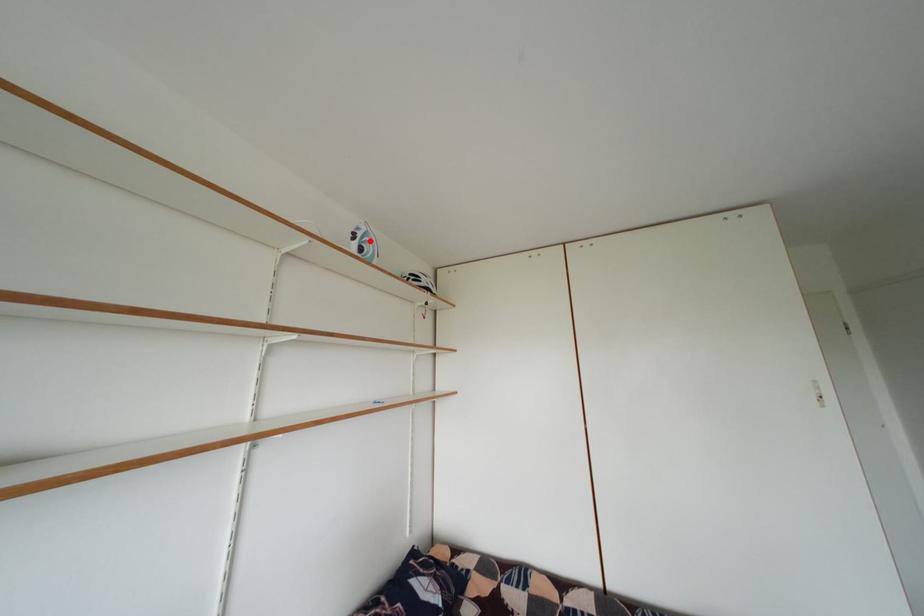
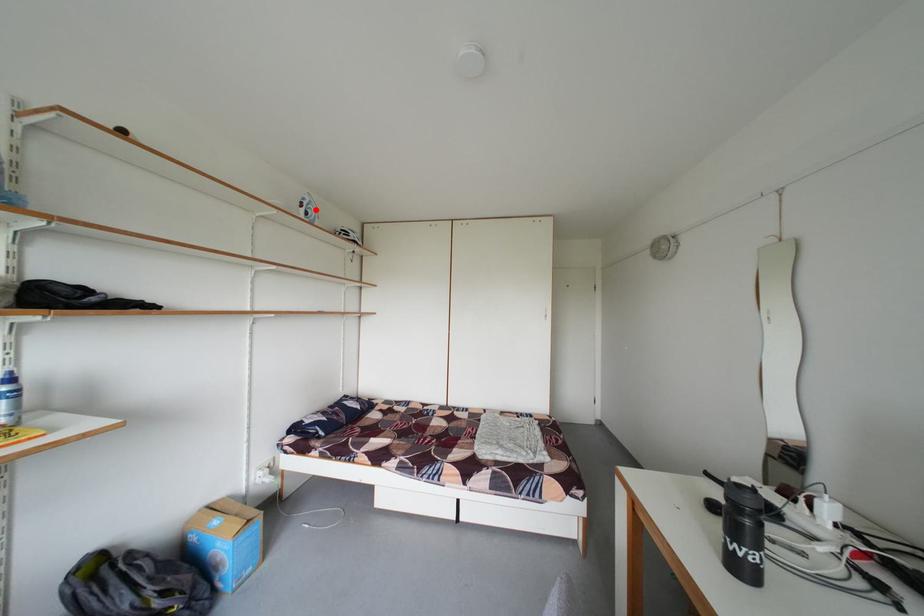
I am providing you with two images of the same scene from different viewpoints. A red point is marked on the first image and another point is marked on the second image. Are the points marked in image1 and image2 representing the same 3D position?

Yes